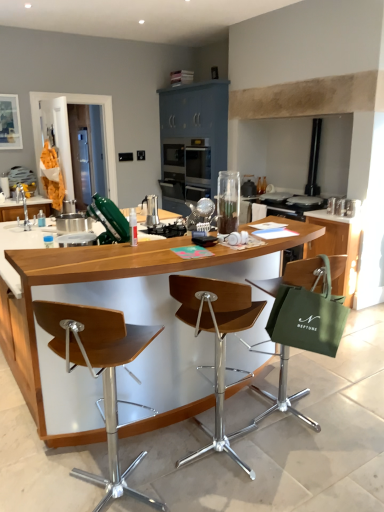
Question: From the image's perspective, is wooden seat at center, marked as the 2th chair in a right-to-left arrangement, on top of green fabric bag at right, the second cabinetry viewed from the back?

Choices:
 (A) yes
 (B) no

Answer: (B)

Question: Is wooden seat at center, which appears as the 2th chair when viewed from the left, next to green fabric bag at right, arranged as the first cabinetry when viewed from the right, and touching it?

Choices:
 (A) yes
 (B) no

Answer: (B)

Question: Are wooden seat at center, which appears as the 2th chair when viewed from the left, and green fabric bag at right, which is counted as the second cabinetry, starting from the top, far apart?

Choices:
 (A) yes
 (B) no

Answer: (A)

Question: Is wooden seat at center, which appears as the 2th chair when viewed from the left, aimed at green fabric bag at right, which is the 2th cabinetry in left-to-right order?

Choices:
 (A) yes
 (B) no

Answer: (A)

Question: Is wooden seat at center, marked as the 2th chair in a right-to-left arrangement, thinner than green fabric bag at right, arranged as the first cabinetry when viewed from the right?

Choices:
 (A) no
 (B) yes

Answer: (B)

Question: Would you say wooden seat at center, which appears as the 2th chair when viewed from the left, contains green fabric bag at right, the second cabinetry viewed from the back?

Choices:
 (A) no
 (B) yes

Answer: (A)

Question: Is wooden seat at center, marked as the 2th chair in a right-to-left arrangement, next to green fabric chair at right, the first chair when ordered from right to left?

Choices:
 (A) yes
 (B) no

Answer: (B)

Question: Is wooden seat at center, which appears as the 2th chair when viewed from the left, facing towards green fabric chair at right, which ranks as the 3th chair in left-to-right order?

Choices:
 (A) no
 (B) yes

Answer: (B)

Question: Would you say green fabric chair at right, the first chair when ordered from right to left, is part of wooden seat at center, marked as the 2th chair in a right-to-left arrangement,'s contents?

Choices:
 (A) no
 (B) yes

Answer: (A)

Question: Is wooden seat at center, which appears as the 2th chair when viewed from the left, outside of green fabric chair at right, the first chair when ordered from right to left?

Choices:
 (A) yes
 (B) no

Answer: (A)

Question: Does wooden seat at center, marked as the 2th chair in a right-to-left arrangement, have a lesser height compared to green fabric chair at right, the first chair when ordered from right to left?

Choices:
 (A) yes
 (B) no

Answer: (B)

Question: Does wooden seat at center, which appears as the 2th chair when viewed from the left, have a larger size compared to green fabric chair at right, which ranks as the 3th chair in left-to-right order?

Choices:
 (A) yes
 (B) no

Answer: (A)

Question: Considering the relative sizes of green fabric shopping bag at right and wooden seat at center, marked as the 2th chair in a right-to-left arrangement, in the image provided, is green fabric shopping bag at right wider than wooden seat at center, marked as the 2th chair in a right-to-left arrangement,?

Choices:
 (A) yes
 (B) no

Answer: (B)